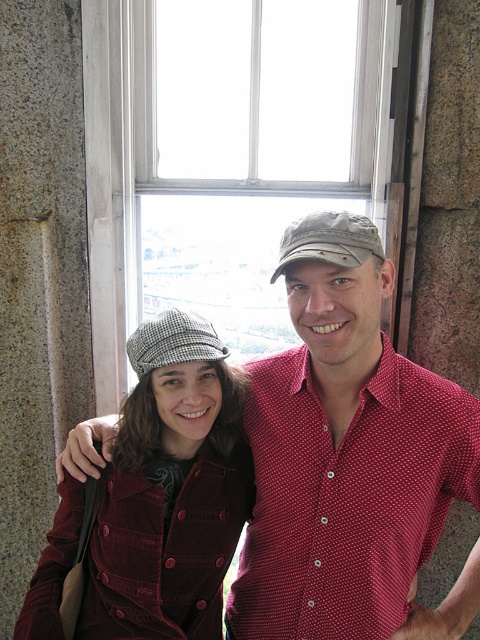
Question: Does matte red shirt at center come behind velvet maroon coat at center?

Choices:
 (A) yes
 (B) no

Answer: (B)

Question: Which object is the closest to the matte red shirt at center?

Choices:
 (A) velvet maroon coat at center
 (B) red dotted shirt at center

Answer: (B)

Question: Is matte red shirt at center positioned at the back of red dotted shirt at center?

Choices:
 (A) no
 (B) yes

Answer: (A)

Question: Does matte red shirt at center appear on the right side of velvet maroon coat at center?

Choices:
 (A) no
 (B) yes

Answer: (B)

Question: Which of the following is the farthest from the observer?

Choices:
 (A) red dotted shirt at center
 (B) velvet maroon coat at center

Answer: (B)

Question: Which object appears farthest from the camera in this image?

Choices:
 (A) matte red shirt at center
 (B) velvet maroon coat at center
 (C) red dotted shirt at center

Answer: (B)